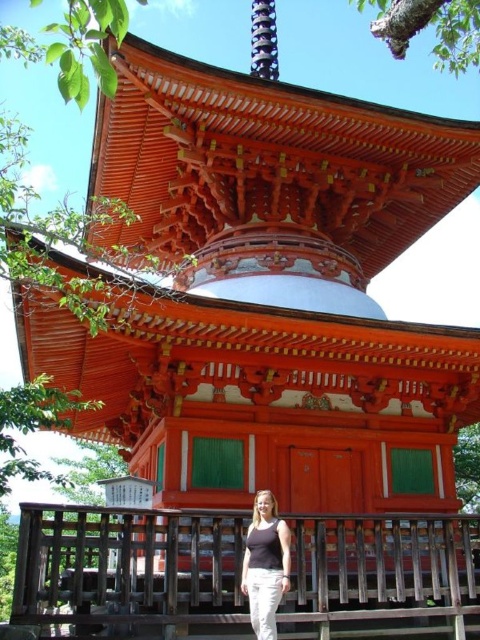
You are a photographer planning to take a photo of the brown wooden rail at lower center and the matte black tank top at center. Which object should you focus on first if you want to capture both in a single frame without moving the camera?

The brown wooden rail at lower center is much taller than the matte black tank top at center, so you should focus on the brown wooden rail at lower center first to ensure both are in focus.